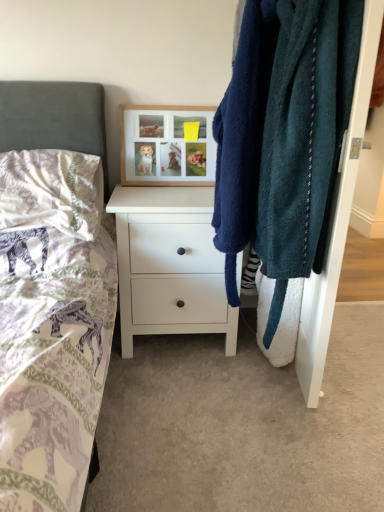
Question: Is woodenobject at upper center surrounded by white matte chest of drawers at center?

Choices:
 (A) no
 (B) yes

Answer: (A)

Question: Is white matte chest of drawers at center at the left side of woodenobject at upper center?

Choices:
 (A) no
 (B) yes

Answer: (A)

Question: Can you confirm if white matte chest of drawers at center is shorter than woodenobject at upper center?

Choices:
 (A) no
 (B) yes

Answer: (A)

Question: Is white matte chest of drawers at center to the right of woodenobject at upper center from the viewer's perspective?

Choices:
 (A) no
 (B) yes

Answer: (B)

Question: From a real-world perspective, does white matte chest of drawers at center sit lower than woodenobject at upper center?

Choices:
 (A) yes
 (B) no

Answer: (A)

Question: From a real-world perspective, is white matte chest of drawers at center physically above woodenobject at upper center?

Choices:
 (A) yes
 (B) no

Answer: (B)

Question: Is silky white pillow at left aimed at woodenobject at upper center?

Choices:
 (A) yes
 (B) no

Answer: (B)

Question: Is silky white pillow at left next to woodenobject at upper center?

Choices:
 (A) yes
 (B) no

Answer: (B)

Question: Does silky white pillow at left contain woodenobject at upper center?

Choices:
 (A) yes
 (B) no

Answer: (B)

Question: From a real-world perspective, is silky white pillow at left under woodenobject at upper center?

Choices:
 (A) no
 (B) yes

Answer: (B)

Question: Considering the relative sizes of silky white pillow at left and woodenobject at upper center in the image provided, is silky white pillow at left wider than woodenobject at upper center?

Choices:
 (A) no
 (B) yes

Answer: (B)

Question: Considering the relative sizes of silky white pillow at left and woodenobject at upper center in the image provided, is silky white pillow at left bigger than woodenobject at upper center?

Choices:
 (A) yes
 (B) no

Answer: (A)

Question: Is the depth of white matte chest of drawers at center less than that of silky white pillow at left?

Choices:
 (A) yes
 (B) no

Answer: (B)